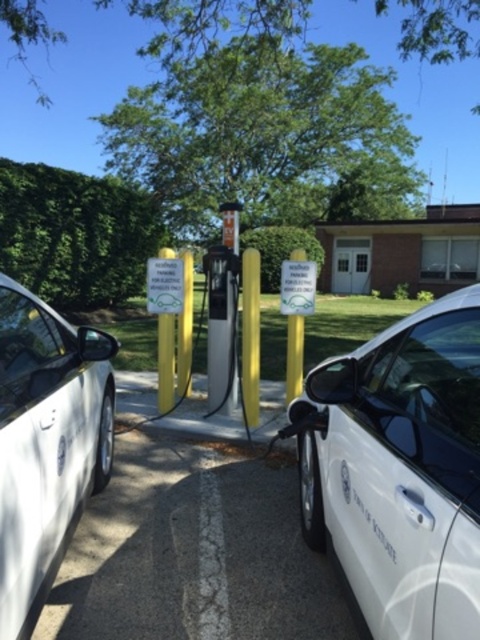
You are driving a compact car that is 3.8 meters long and need to park between the white glossy car at center and the white matte car at left. Can your car fit in the space between them without overlapping either vehicle?

The space between the white glossy car at center and the white matte car at left is 1.26 meters. Since your car is 3.8 meters long, it cannot fit in the space between them without overlapping either vehicle.

You are a delivery driver who needs to park your EV at the charging station. The charging station is between two parked cars. Which car, the white glossy car at center or the white matte car at left, is blocking the charging station more?

The white glossy car at center is positioned over the white matte car at left, meaning it is closer to the charging station and thus blocking it more.

You are a delivery driver who needs to park your van between the white glossy car at center and the white matte car at left at the EV charging station. Your van is 2 meters wide. Can you fit your van between them without touching either car?

The white glossy car at center is wider than the white matte car at left. However, the distance between the two cars is not provided in the scene description, so it is impossible to determine if the van can fit without additional information.